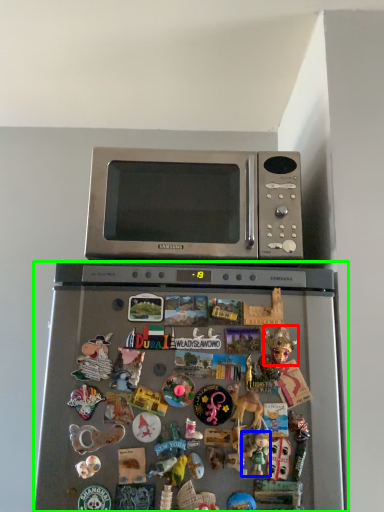
Question: Based on their relative distances, which object is farther from toy (highlighted by a red box)? Choose from toy (highlighted by a blue box) and refrigerator (highlighted by a green box).

Choices:
 (A) toy
 (B) refrigerator

Answer: (B)